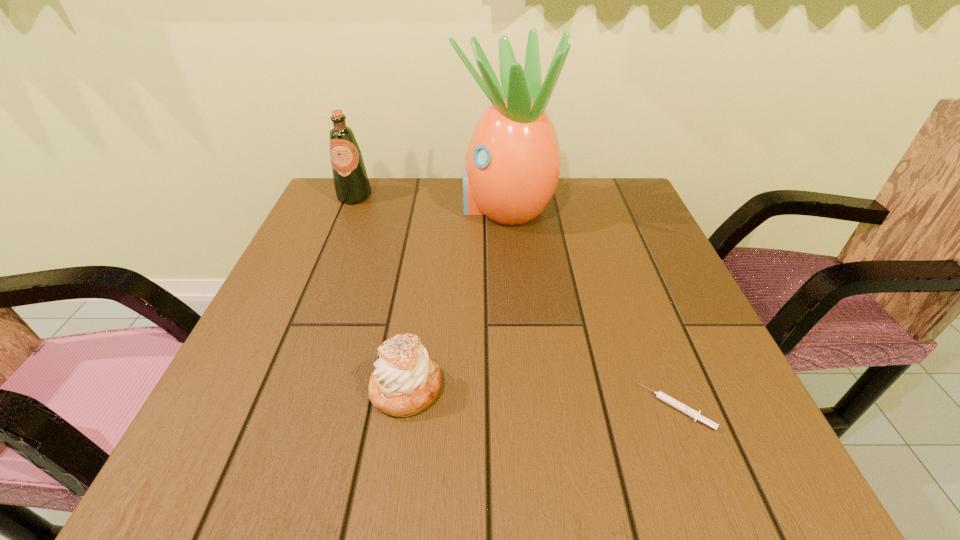
Where is `free region located 0.230m at the entrance of the second object from right to left`? The width and height of the screenshot is (960, 540). free region located 0.230m at the entrance of the second object from right to left is located at coordinates (368, 207).

Locate an element on the screen. This screenshot has width=960, height=540. free region located 0.250m on the front-facing side of the olive oil is located at coordinates (324, 268).

Find the location of a particular element. free region located 0.230m on the left of the third tallest object is located at coordinates (231, 388).

You are a GUI agent. You are given a task and a screenshot of the screen. Output one action in this format:
    pyautogui.click(x=<x>, y=<y>)
    Task: Click on the vacant space located 0.390m on the left of the rightmost object
    
    Given the screenshot: What is the action you would take?
    [396, 408]

The image size is (960, 540). What are the coordinates of `pineapple located at the far edge` in the screenshot? It's located at (513, 161).

You are a GUI agent. You are given a task and a screenshot of the screen. Output one action in this format:
    pyautogui.click(x=<x>, y=<y>)
    Task: Click on the olive oil located in the far edge section of the desktop
    
    Given the screenshot: What is the action you would take?
    pyautogui.click(x=351, y=183)

Identify the location of object at the near edge. This screenshot has width=960, height=540. (694, 414).

Locate an element on the screen. object present at the left edge is located at coordinates tap(351, 183).

At what (x,y) coordinates should I click in order to perform the action: click on object at the right edge. Please return your answer as a coordinate pair (x, y). The height and width of the screenshot is (540, 960). Looking at the image, I should click on (694, 414).

Locate an element on the screen. The width and height of the screenshot is (960, 540). object that is positioned at the far left corner is located at coordinates (351, 183).